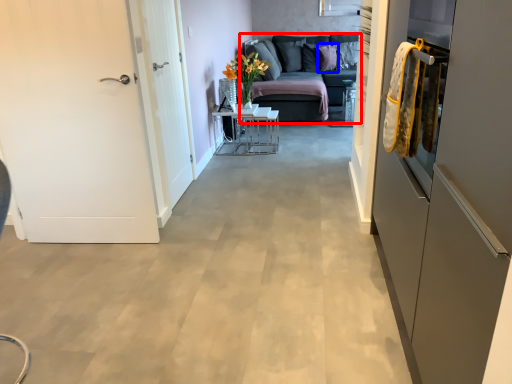
Question: Which point is further to the camera, studio couch (highlighted by a red box) or pillow (highlighted by a blue box)?

Choices:
 (A) studio couch
 (B) pillow

Answer: (B)